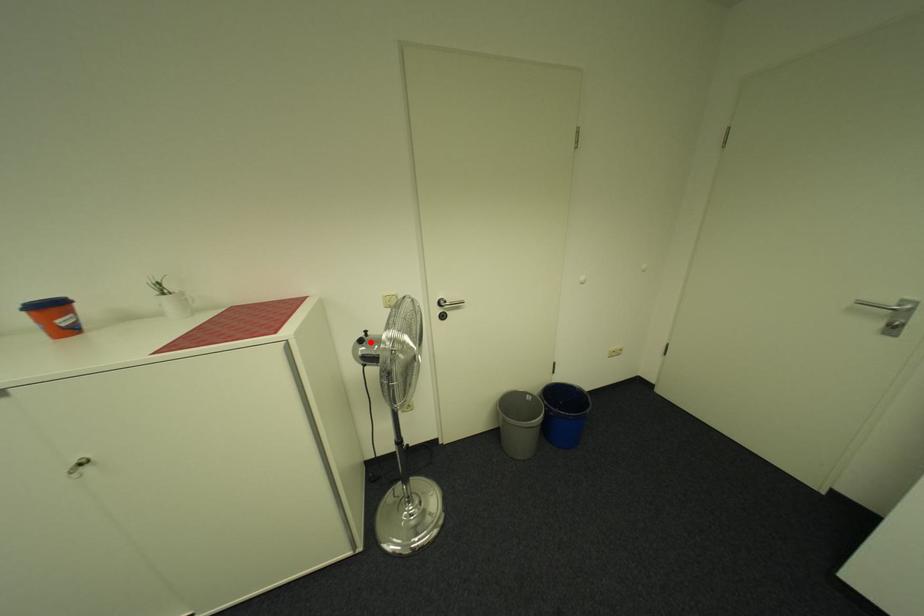
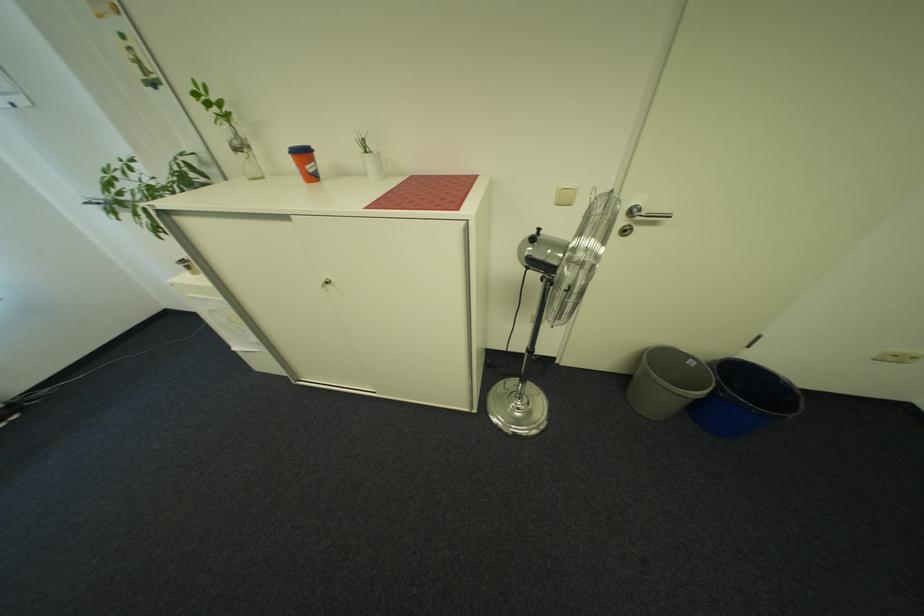
In the second image, find the point that corresponds to the highlighted location in the first image.

(542, 240)